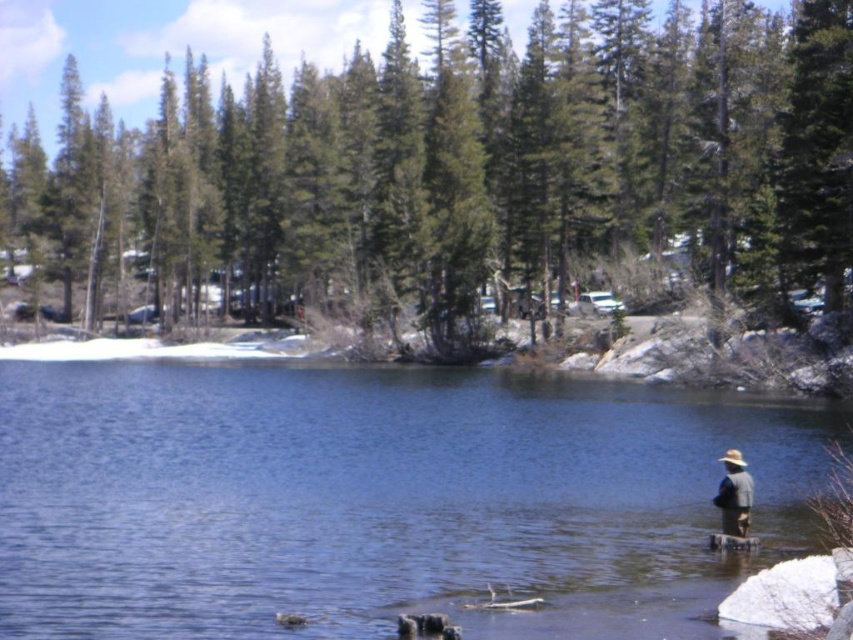
Between green textured pine trees at upper center and gray fabric hat at lower right, which one is positioned higher?

green textured pine trees at upper center is above.

The image size is (853, 640). I want to click on green textured pine trees at upper center, so click(x=454, y=172).

The image size is (853, 640). I want to click on green textured pine trees at upper center, so click(x=454, y=172).

Find the location of a particular element. The height and width of the screenshot is (640, 853). green textured pine trees at upper center is located at coordinates point(454,172).

Can you confirm if green textured pine trees at upper center is smaller than blue water at center?

Incorrect, green textured pine trees at upper center is not smaller in size than blue water at center.

Does point (285, 236) come in front of point (68, 627)?

No.

Locate an element on the screen. The width and height of the screenshot is (853, 640). green textured pine trees at upper center is located at coordinates (454, 172).

Describe the element at coordinates (376, 499) in the screenshot. Image resolution: width=853 pixels, height=640 pixels. I see `blue water at center` at that location.

Does point (189, 470) come in front of point (744, 529)?

No.

Image resolution: width=853 pixels, height=640 pixels. I want to click on blue water at center, so click(x=376, y=499).